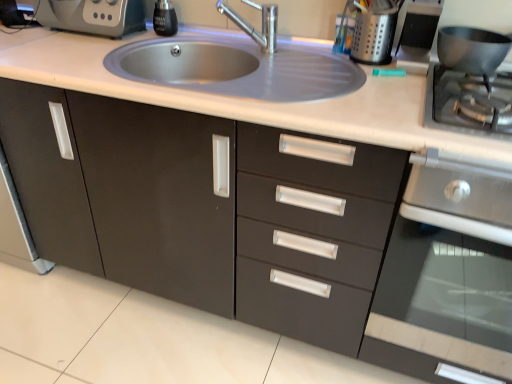
This screenshot has width=512, height=384. I want to click on satin steel sink at center, so click(236, 68).

This screenshot has width=512, height=384. Describe the element at coordinates (236, 68) in the screenshot. I see `satin steel sink at center` at that location.

What is the approximate height of matte black pot at right, which is counted as the 3th appliance, starting from the left?

matte black pot at right, which is counted as the 3th appliance, starting from the left, is 3.53 inches tall.

Find the location of a particular element. This screenshot has height=384, width=512. black glass soap dispenser at upper center is located at coordinates (164, 19).

In order to click on stainless steel oven at right in this screenshot , I will do `click(446, 277)`.

This screenshot has height=384, width=512. I want to click on polished chrome faucet at upper center, so click(253, 27).

You are a GUI agent. You are given a task and a screenshot of the screen. Output one action in this format:
    pyautogui.click(x=<x>, y=<y>)
    Task: Click on the stainless steel gas stove at right
    This screenshot has width=512, height=384.
    Given the screenshot: What is the action you would take?
    pyautogui.click(x=455, y=103)

Is polished chrome faucet at upper center bigger than black glass soap dispenser at upper center?

Yes, polished chrome faucet at upper center is bigger than black glass soap dispenser at upper center.

Does polished chrome faucet at upper center have a lesser height compared to black glass soap dispenser at upper center?

In fact, polished chrome faucet at upper center may be taller than black glass soap dispenser at upper center.

Is polished chrome faucet at upper center inside or outside of black glass soap dispenser at upper center?

polished chrome faucet at upper center is not inside black glass soap dispenser at upper center, it's outside.

Which is more to the left, polished chrome faucet at upper center or black glass soap dispenser at upper center?

From the viewer's perspective, black glass soap dispenser at upper center appears more on the left side.

Looking at this image, which object is further away from the camera taking this photo, teal plastic marker at upper right, placed as the second appliance when sorted from left to right, or metallic gray coffee machine at upper left?

Positioned behind is metallic gray coffee machine at upper left.

Identify the location of appliance that is the 2nd object located in front of the metallic gray coffee machine at upper left. This screenshot has width=512, height=384. (418, 35).

Does point (418, 16) come behind point (130, 5)?

No, it is not.

Does stainless steel gas stove at right have a greater width compared to satin steel sink at center?

Incorrect, the width of stainless steel gas stove at right does not surpass that of satin steel sink at center.

Is point (458, 113) closer to viewer compared to point (201, 78)?

Yes.

What's the angular difference between stainless steel gas stove at right and satin steel sink at center's facing directions?

The angle between the facing direction of stainless steel gas stove at right and the facing direction of satin steel sink at center is 4.33e-05 degrees.

Is satin steel sink at center located within stainless steel gas stove at right?

Actually, satin steel sink at center is outside stainless steel gas stove at right.

Locate an element on the screen. Image resolution: width=512 pixels, height=384 pixels. gas stove below the polished chrome faucet at upper center (from a real-world perspective) is located at coordinates (455, 103).

Which object is closer to the camera taking this photo, polished chrome faucet at upper center or stainless steel gas stove at right?

stainless steel gas stove at right is more forward.

Considering the sizes of polished chrome faucet at upper center and stainless steel gas stove at right in the image, is polished chrome faucet at upper center wider or thinner than stainless steel gas stove at right?

Considering their sizes, polished chrome faucet at upper center looks slimmer than stainless steel gas stove at right.

From a real-world perspective, who is located higher, polished chrome faucet at upper center or stainless steel gas stove at right?

polished chrome faucet at upper center.

Is stainless steel gas stove at right facing towards satin silver utensil holder at upper right, which is counted as the first appliance, starting from the left?

No, stainless steel gas stove at right is not facing towards satin silver utensil holder at upper right, which is counted as the first appliance, starting from the left.

Is satin silver utensil holder at upper right, acting as the 3th appliance starting from the right, completely or partially inside stainless steel gas stove at right?

That's incorrect, satin silver utensil holder at upper right, acting as the 3th appliance starting from the right, is not inside stainless steel gas stove at right.

Is stainless steel gas stove at right positioned behind satin silver utensil holder at upper right, acting as the 3th appliance starting from the right?

No, stainless steel gas stove at right is closer to the camera.

How many degrees apart are the facing directions of stainless steel gas stove at right and satin silver utensil holder at upper right, which is counted as the first appliance, starting from the left?

They differ by 1.89 degrees in their facing directions.

From the image's perspective, which one is positioned lower, polished chrome faucet at upper center or stainless steel oven at right?

stainless steel oven at right is shown below in the image.

Locate an element on the screen. The height and width of the screenshot is (384, 512). tap behind the stainless steel oven at right is located at coordinates (253, 27).

Is polished chrome faucet at upper center at the right side of stainless steel oven at right?

No.

Is polished chrome faucet at upper center turned away from stainless steel oven at right?

No, polished chrome faucet at upper center is not facing away from stainless steel oven at right.

Considering the sizes of objects polished chrome faucet at upper center and metallic gray coffee machine at upper left in the image provided, who is shorter, polished chrome faucet at upper center or metallic gray coffee machine at upper left?

Standing shorter between the two is metallic gray coffee machine at upper left.

Is polished chrome faucet at upper center spatially inside metallic gray coffee machine at upper left, or outside of it?

polished chrome faucet at upper center lies outside metallic gray coffee machine at upper left.

From a real-world perspective, who is located higher, polished chrome faucet at upper center or metallic gray coffee machine at upper left?

polished chrome faucet at upper center, from a real-world perspective.

Between polished chrome faucet at upper center and metallic gray coffee machine at upper left, which one is positioned in front?

polished chrome faucet at upper center is in front.

The width and height of the screenshot is (512, 384). I want to click on soap dispenser beneath the polished chrome faucet at upper center (from a real-world perspective), so click(x=164, y=19).

The width and height of the screenshot is (512, 384). Identify the location of the 2nd appliance located above the metallic gray coffee machine at upper left (from a real-world perspective). (418, 35).

From the image, which object appears to be farther from stainless steel oven at right, satin silver utensil holder at upper right, which is counted as the first appliance, starting from the left, or matte black pot at right, which is counted as the 3th appliance, starting from the left?

Based on the image, satin silver utensil holder at upper right, which is counted as the first appliance, starting from the left, appears to be further to stainless steel oven at right.

When comparing their distances from matte black pot at right, the first appliance viewed from the right, does teal plastic marker at upper right, placed as the second appliance when sorted from left to right, or stainless steel gas stove at right seem closer?

The object closer to matte black pot at right, the first appliance viewed from the right, is teal plastic marker at upper right, placed as the second appliance when sorted from left to right.

Considering their positions, is black glass soap dispenser at upper center positioned further to stainless steel oven at right than metallic gray coffee machine at upper left?

Among the two, metallic gray coffee machine at upper left is located further to stainless steel oven at right.

When comparing their distances from stainless steel gas stove at right, does black glass soap dispenser at upper center or teal plastic marker at upper right, placed as the second appliance when sorted from left to right, seem closer?

Among the two, teal plastic marker at upper right, placed as the second appliance when sorted from left to right, is located nearer to stainless steel gas stove at right.

Considering their positions, is satin silver utensil holder at upper right, acting as the 3th appliance starting from the right, positioned further to polished chrome faucet at upper center than stainless steel oven at right?

Based on the image, stainless steel oven at right appears to be further to polished chrome faucet at upper center.

Based on their spatial positions, is stainless steel gas stove at right or stainless steel oven at right further from black glass soap dispenser at upper center?

The object further to black glass soap dispenser at upper center is stainless steel oven at right.

Looking at the image, which one is located closer to stainless steel oven at right, polished chrome faucet at upper center or teal plastic marker at upper right, placed as the second appliance when sorted from left to right?

teal plastic marker at upper right, placed as the second appliance when sorted from left to right, lies closer to stainless steel oven at right than the other object.

Looking at the image, which one is located further to stainless steel gas stove at right, black glass soap dispenser at upper center or polished chrome faucet at upper center?

Based on the image, black glass soap dispenser at upper center appears to be further to stainless steel gas stove at right.

At what (x,y) coordinates should I click in order to perform the action: click on sink between black glass soap dispenser at upper center and stainless steel oven at right. Please return your answer as a coordinate pair (x, y). The width and height of the screenshot is (512, 384). Looking at the image, I should click on (236, 68).

At what (x,y) coordinates should I click in order to perform the action: click on sink situated between metallic gray coffee machine at upper left and teal plastic marker at upper right, the second appliance in the right-to-left sequence, from left to right. Please return your answer as a coordinate pair (x, y). The image size is (512, 384). Looking at the image, I should click on (236, 68).

You are a GUI agent. You are given a task and a screenshot of the screen. Output one action in this format:
    pyautogui.click(x=<x>, y=<y>)
    Task: Click on the soap dispenser located between metallic gray coffee machine at upper left and satin silver utensil holder at upper right, acting as the 3th appliance starting from the right, in the left-right direction
    The image size is (512, 384).
    Given the screenshot: What is the action you would take?
    pyautogui.click(x=164, y=19)

Identify the location of tap between satin steel sink at center and teal plastic marker at upper right, the second appliance in the right-to-left sequence. The image size is (512, 384). (253, 27).